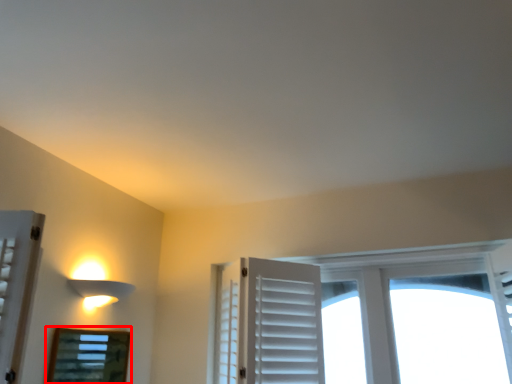
Question: Where is bay window (annotated by the red box) located in relation to lamp in the image?

Choices:
 (A) right
 (B) left

Answer: (B)